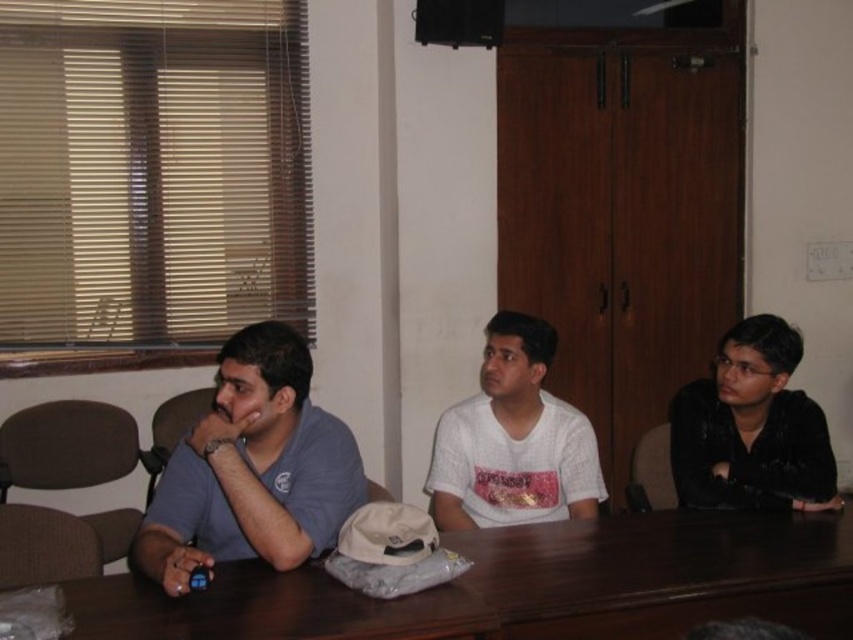
Is brown wooden table at center further to the viewer compared to white matte shirt at center?

No, it is not.

Does brown wooden table at center have a greater width compared to white matte shirt at center?

Correct, the width of brown wooden table at center exceeds that of white matte shirt at center.

Locate an element on the screen. Image resolution: width=853 pixels, height=640 pixels. brown wooden table at center is located at coordinates (521, 586).

Who is lower down, blue matte shirt at left or white matte shirt at center?

blue matte shirt at left

Who is more forward, (351, 502) or (498, 360)?

Positioned in front is point (351, 502).

At what (x,y) coordinates should I click in order to perform the action: click on blue matte shirt at left. Please return your answer as a coordinate pair (x, y). The height and width of the screenshot is (640, 853). Looking at the image, I should click on (252, 468).

You are a GUI agent. You are given a task and a screenshot of the screen. Output one action in this format:
    pyautogui.click(x=<x>, y=<y>)
    Task: Click on the brown wooden table at center
    
    Given the screenshot: What is the action you would take?
    pyautogui.click(x=521, y=586)

Which is behind, point (709, 516) or point (242, 401)?

The point (709, 516) is more distant.

Identify the location of brown wooden table at center. Image resolution: width=853 pixels, height=640 pixels. (521, 586).